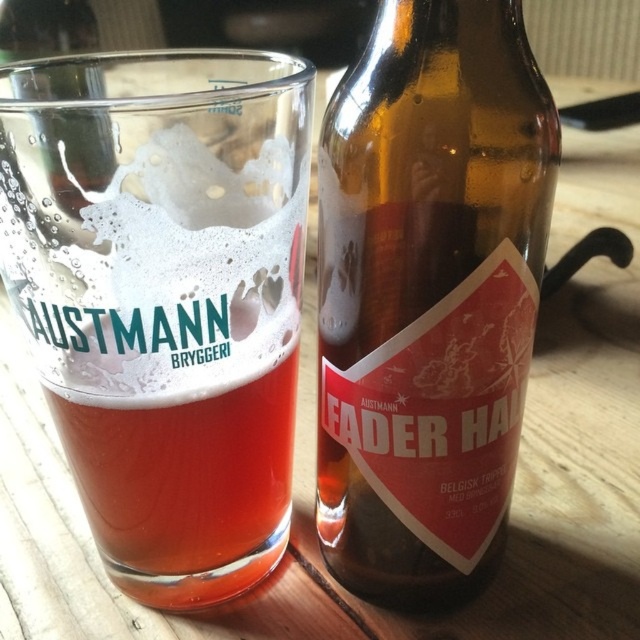
You are at a bar and want to pour the remaining liquid from the transparent glass bottle at center into the clear glass beer at center. Is the bottle positioned above the glass?

The clear glass beer at center is located below the transparent glass bottle at center, so yes, the bottle is positioned above the glass, allowing you to pour the liquid easily.

You are a bartender who needs to place a coaster under the clear glass beer at center to prevent watermarks on the wooden table. However, the transparent glass bottle at center is blocking your access. Can you slide the coaster between them?

The clear glass beer at center is in front of the transparent glass bottle at center, so you can slide the coaster between them by moving it behind the clear glass beer at center and in front of the transparent glass bottle at center.